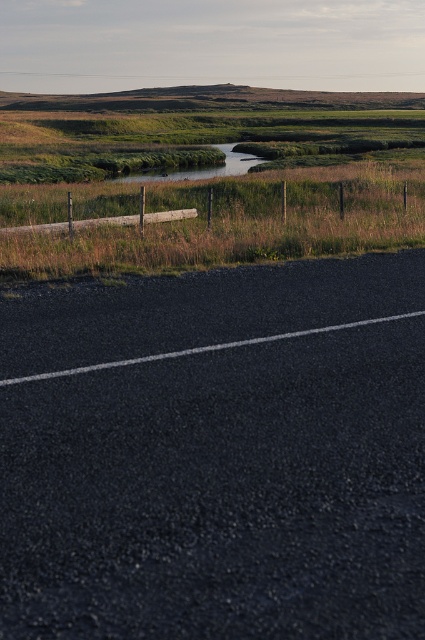
You are standing at the point with coordinates point (x=249, y=156) and want to walk towards the road. There is another point at point (x=186, y=557). Which direction should you walk to reach the road first?

You should walk towards point (x=186, y=557) because it is in front of point (x=249, y=156) and closer to the road.

You are a bird flying over a rural area. You see the black asphalt highway at lower center and the green grass at upper center. Which object is located higher in the image?

The green grass at upper center is located higher in the image than the black asphalt highway at lower center.